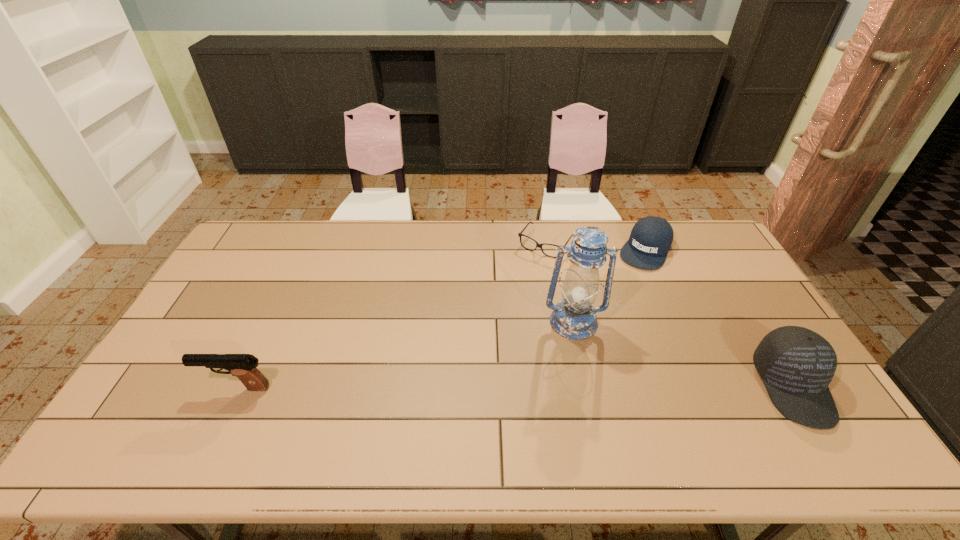
I want to click on vacant space on the desktop that is between the pistol and the right baseball cap and is positioned on the front-facing side of the farther baseball cap, so click(569, 387).

Where is `vacant spot on the desktop that is between the leftmost object and the nearer baseball cap and is positioned on the front-facing side of the third farthest object`? This screenshot has height=540, width=960. vacant spot on the desktop that is between the leftmost object and the nearer baseball cap and is positioned on the front-facing side of the third farthest object is located at coordinates (581, 387).

What are the coordinates of `free spot on the desktop that is between the pistol and the rightmost object and is positioned on the front-facing side of the spectacles` in the screenshot? It's located at (442, 387).